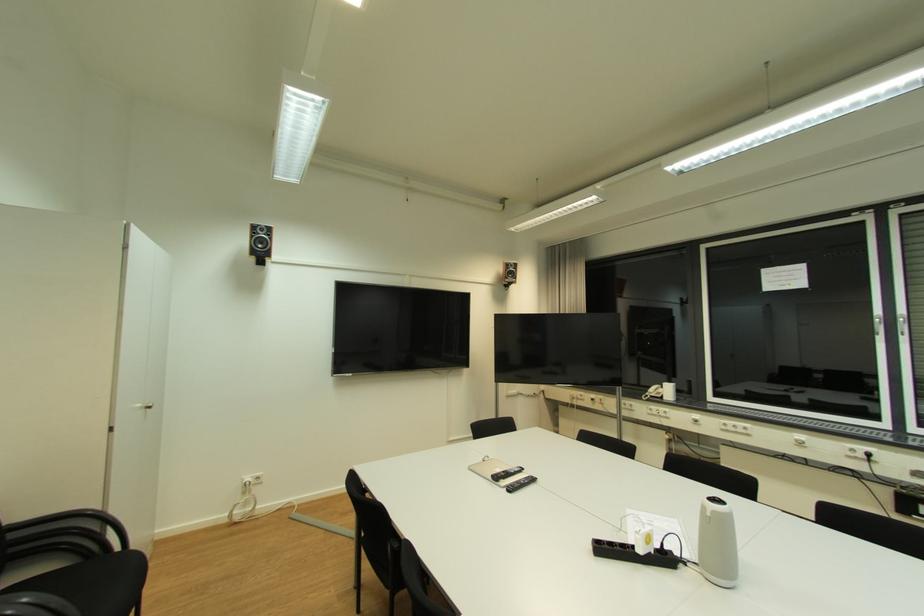
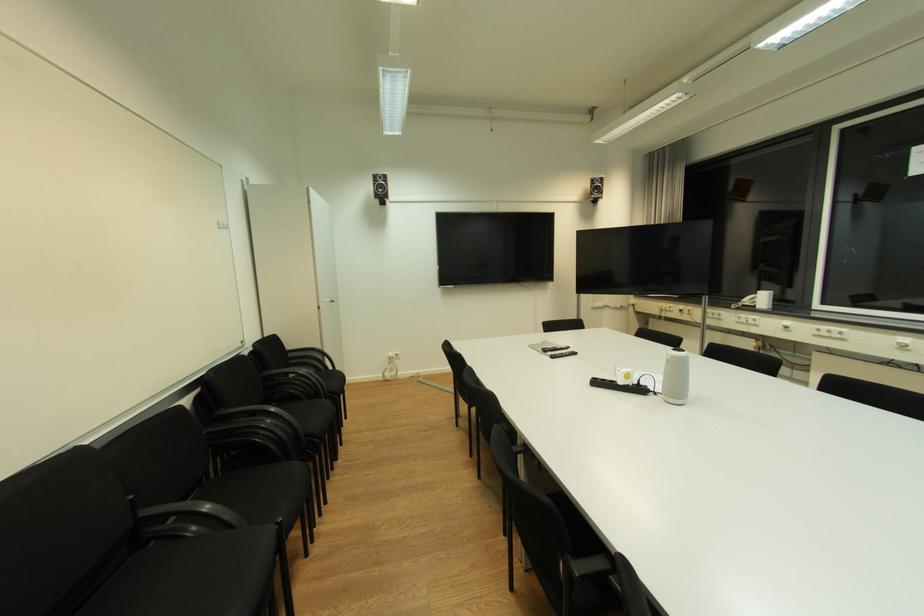
Find the pixel in the second image that matches pixel 646 553 in the first image.

(626, 384)